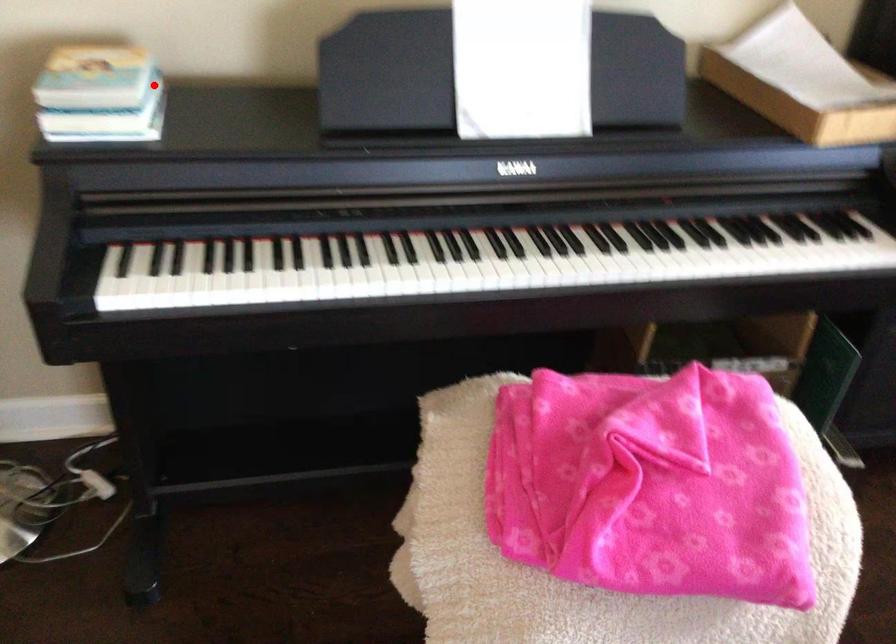
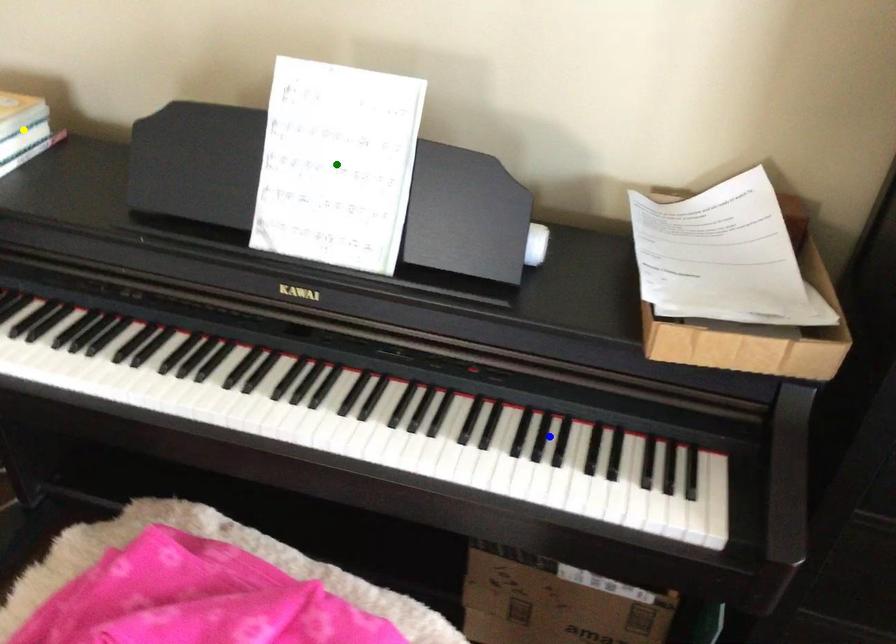
Question: I am providing you with two images of the same scene from different viewpoints. A red point is marked on the first image. You are given multiple points on the second image. Can you choose the point in image 2 that corresponds to the point in image 1?

Choices:
 (A) green point
 (B) yellow point
 (C) blue point

Answer: (B)